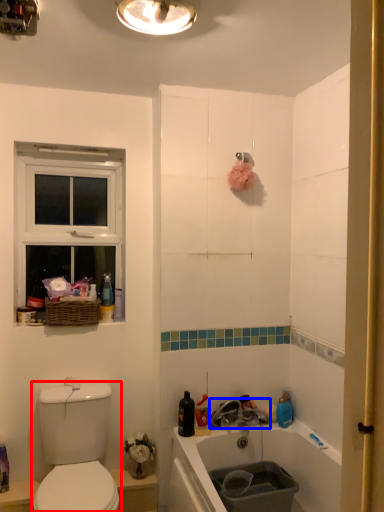
Question: Which object appears closest to the camera in this image, sink (highlighted by a red box) or tap (highlighted by a blue box)?

Choices:
 (A) sink
 (B) tap

Answer: (A)